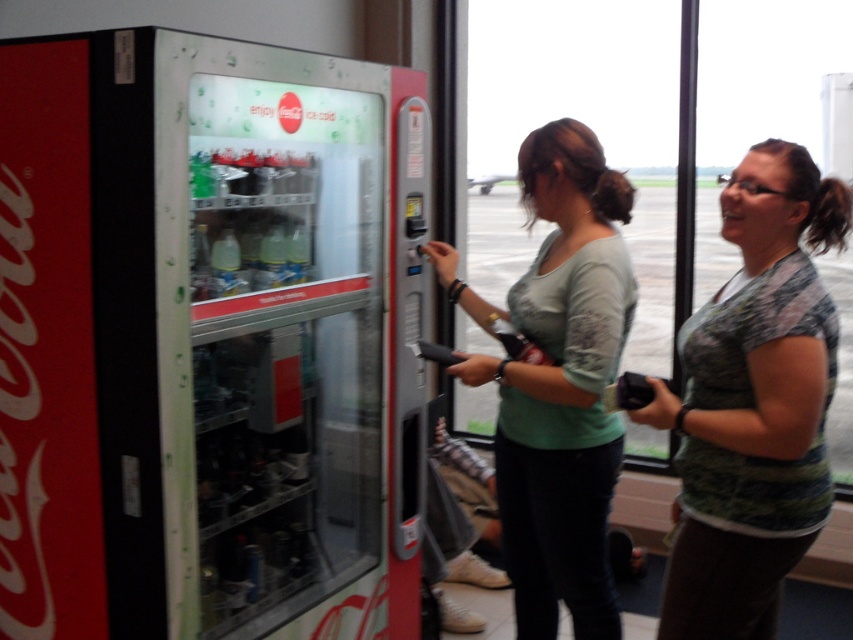
Is metallic silver vending machine at left shorter than camouflage shirt at center?

Incorrect, metallic silver vending machine at left's height does not fall short of camouflage shirt at center's.

Is point (370, 70) positioned behind point (717, 540)?

Yes, point (370, 70) is farther from viewer.

The width and height of the screenshot is (853, 640). I want to click on metallic silver vending machine at left, so click(x=204, y=340).

Is metallic silver vending machine at left below light green fabric shirt at center?

No.

Is metallic silver vending machine at left to the right of light green fabric shirt at center from the viewer's perspective?

In fact, metallic silver vending machine at left is to the left of light green fabric shirt at center.

Does point (99, 92) come farther from viewer compared to point (606, 189)?

No.

Locate an element on the screen. The width and height of the screenshot is (853, 640). metallic silver vending machine at left is located at coordinates (204, 340).

Is camouflage shirt at center below light green fabric shirt at center?

No, camouflage shirt at center is not below light green fabric shirt at center.

Is camouflage shirt at center smaller than light green fabric shirt at center?

Yes, camouflage shirt at center is smaller than light green fabric shirt at center.

This screenshot has height=640, width=853. I want to click on camouflage shirt at center, so click(x=753, y=403).